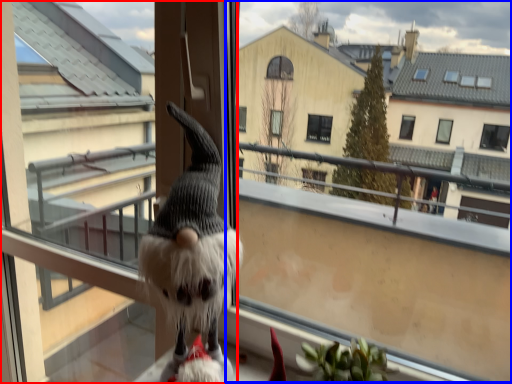
Question: Which object is further to the camera taking this photo, screen door (highlighted by a red box) or window screen (highlighted by a blue box)?

Choices:
 (A) screen door
 (B) window screen

Answer: (A)